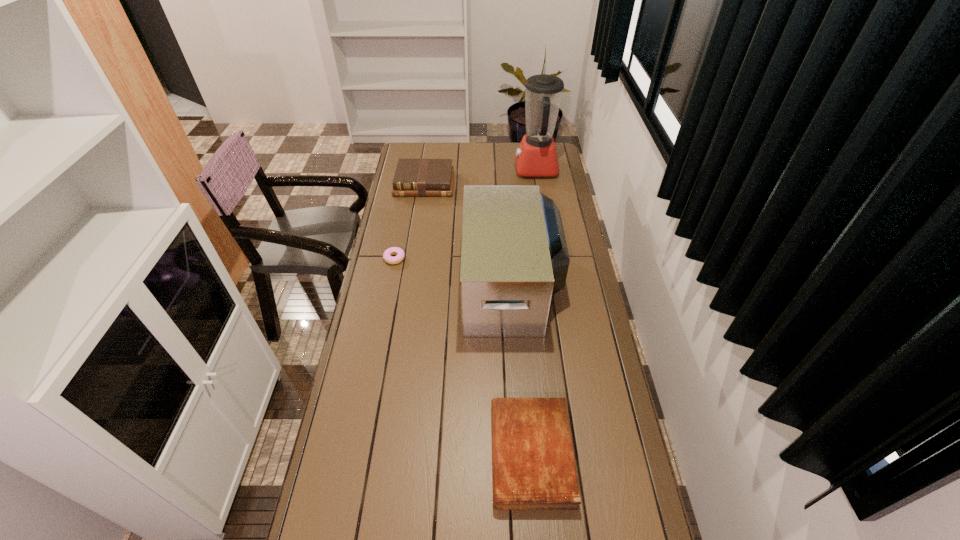
The image size is (960, 540). Identify the location of free space between the tallest object and the third tallest object. (480, 177).

Find the location of a particular element. The width and height of the screenshot is (960, 540). free space that is in between the farther Bible and the tallest object is located at coordinates (480, 177).

Identify the location of object that can be found as the fourth closest to the right Bible. (536, 156).

Where is `object that is the second nearest to the shortest object`? This screenshot has height=540, width=960. object that is the second nearest to the shortest object is located at coordinates (423, 177).

At what (x,y) coordinates should I click in order to perform the action: click on vacant space that satisfies the following two spatial constraints: 1. on the front of the tallest object near the controls; 2. on the spine side of the taller Bible. Please return your answer as a coordinate pair (x, y). Image resolution: width=960 pixels, height=540 pixels. Looking at the image, I should click on (539, 184).